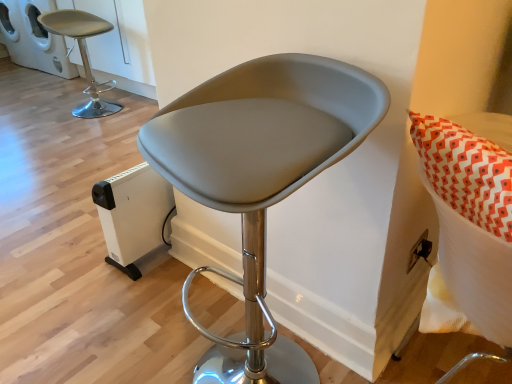
Where is `vacant area that lies to the right of white plastic heater at lower left, which is the 2th appliance from left to right`? The height and width of the screenshot is (384, 512). vacant area that lies to the right of white plastic heater at lower left, which is the 2th appliance from left to right is located at coordinates (182, 275).